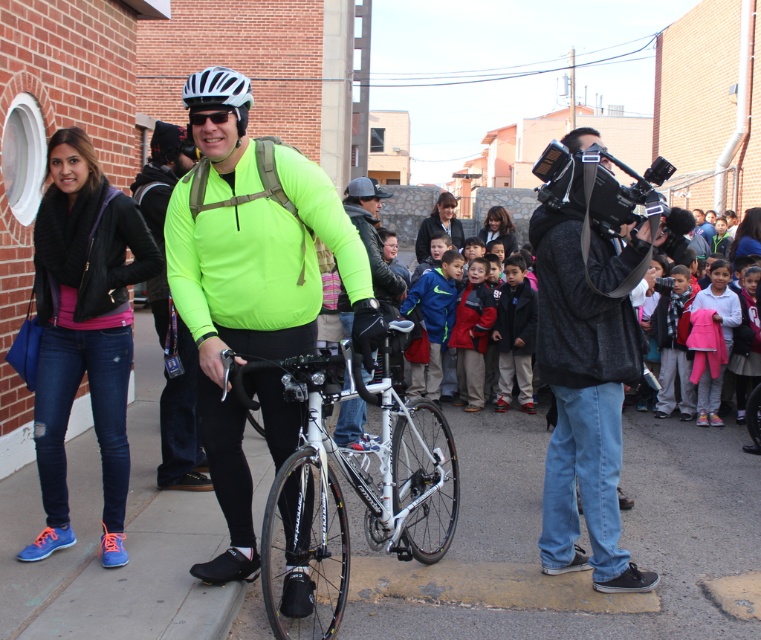
Consider the image. You are a photographer at the event and need to capture a photo that includes both the black leather jacket at left and the black matte goggles at center. What is the minimum distance you need to maintain between these two objects to ensure they both fit in the frame?

The minimum distance you need to maintain between the black leather jacket at left and the black matte goggles at center is 3.43 feet to ensure they both fit in the frame.

You are a photographer at the event and need to choose between the dark gray fabric camera at center and the white matte bicycle helmet at upper center to place in your backpack. Which one will take up more space in your backpack?

The dark gray fabric camera at center is bigger than the white matte bicycle helmet at upper center, so it will take up more space in your backpack.

You are standing at the edge of the scene and want to place a small flag exactly where the white asphalt at center and white matte helmet at center are aligned vertically. Which object should you place the flag closer to, the ground or the sky?

The white asphalt at center is located below white matte helmet at center, so you should place the flag closer to the ground to align them vertically.